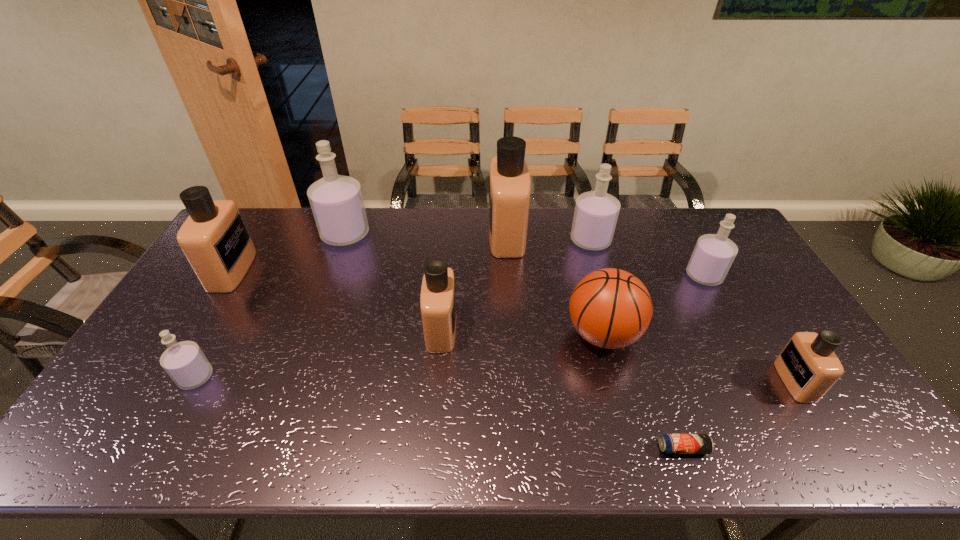
Identify the location of the third closest beige perfume relative to the second biggest beige perfume. This screenshot has width=960, height=540. (808, 366).

Identify which purple perfume is located as the nearest to the basketball. Please provide its 2D coordinates. Your answer should be formatted as a tuple, i.e. [(x, y)], where the tuple contains the x and y coordinates of a point satisfying the conditions above.

[(713, 255)]

In order to click on the second closest purple perfume to the sixth perfume from right to left in this screenshot , I will do `click(596, 212)`.

The width and height of the screenshot is (960, 540). Find the location of `blank space that satisfies the following two spatial constraints: 1. on the back side of the rightmost purple perfume; 2. on the front label of the biggest beige perfume`. blank space that satisfies the following two spatial constraints: 1. on the back side of the rightmost purple perfume; 2. on the front label of the biggest beige perfume is located at coordinates (682, 235).

Image resolution: width=960 pixels, height=540 pixels. Find the location of `vacant space that satisfies the following two spatial constraints: 1. on the front label of the third farthest beige perfume; 2. on the left side of the nearest object`. vacant space that satisfies the following two spatial constraints: 1. on the front label of the third farthest beige perfume; 2. on the left side of the nearest object is located at coordinates (431, 448).